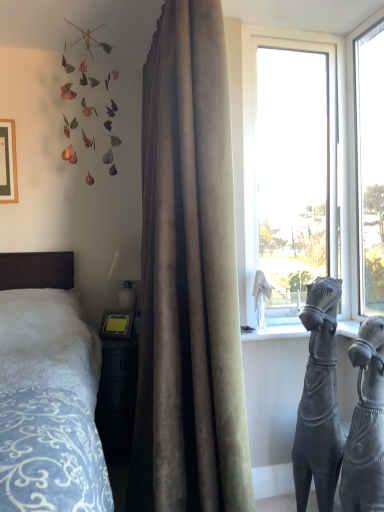
Question: Could metallic leaf mobile at upper left be considered to be inside matte black picture frame at upper left?

Choices:
 (A) yes
 (B) no

Answer: (B)

Question: Considering the relative sizes of matte black picture frame at upper left and metallic leaf mobile at upper left in the image provided, is matte black picture frame at upper left smaller than metallic leaf mobile at upper left?

Choices:
 (A) no
 (B) yes

Answer: (B)

Question: Is matte black picture frame at upper left oriented towards metallic leaf mobile at upper left?

Choices:
 (A) no
 (B) yes

Answer: (A)

Question: Considering the relative sizes of matte black picture frame at upper left and metallic leaf mobile at upper left in the image provided, is matte black picture frame at upper left shorter than metallic leaf mobile at upper left?

Choices:
 (A) yes
 (B) no

Answer: (A)

Question: Considering the relative sizes of matte black picture frame at upper left and metallic leaf mobile at upper left in the image provided, is matte black picture frame at upper left thinner than metallic leaf mobile at upper left?

Choices:
 (A) yes
 (B) no

Answer: (A)

Question: Considering their positions, is white glossy table lamp at upper center located in front of or behind transparent glass window at center, positioned as the second window in right-to-left order?

Choices:
 (A) behind
 (B) front

Answer: (A)

Question: Choose the correct answer: Is white glossy table lamp at upper center inside transparent glass window at center, positioned as the second window in right-to-left order, or outside it?

Choices:
 (A) inside
 (B) outside

Answer: (B)

Question: Looking at their shapes, would you say white glossy table lamp at upper center is wider or thinner than transparent glass window at center, which appears as the 1th window when viewed from the left?

Choices:
 (A) thin
 (B) wide

Answer: (B)

Question: From their relative heights in the image, would you say white glossy table lamp at upper center is taller or shorter than transparent glass window at center, which appears as the 1th window when viewed from the left?

Choices:
 (A) short
 (B) tall

Answer: (A)

Question: Relative to transparent glass sculpture at window, the first sculpture positioned from the top, is transparent glass window at upper right, the 2th window from the left, in front or behind?

Choices:
 (A) front
 (B) behind

Answer: (A)

Question: Is transparent glass window at upper right, the 2th window from the left, wider or thinner than transparent glass sculpture at window, the 2th sculpture in the bottom-to-top sequence?

Choices:
 (A) thin
 (B) wide

Answer: (A)

Question: From the image's perspective, is transparent glass window at upper right, the 2th window from the left, above or below transparent glass sculpture at window, which appears as the 1th sculpture when viewed from the left?

Choices:
 (A) above
 (B) below

Answer: (A)

Question: From a real-world perspective, is transparent glass window at upper right, which is the 1th window from right to left, positioned above or below transparent glass sculpture at window, which appears as the 1th sculpture when viewed from the left?

Choices:
 (A) above
 (B) below

Answer: (A)

Question: From the image's perspective, is metallic leaf mobile at upper left positioned above or below transparent glass window at center, positioned as the second window in right-to-left order?

Choices:
 (A) above
 (B) below

Answer: (A)

Question: Do you think metallic leaf mobile at upper left is within transparent glass window at center, positioned as the second window in right-to-left order, or outside of it?

Choices:
 (A) outside
 (B) inside

Answer: (A)